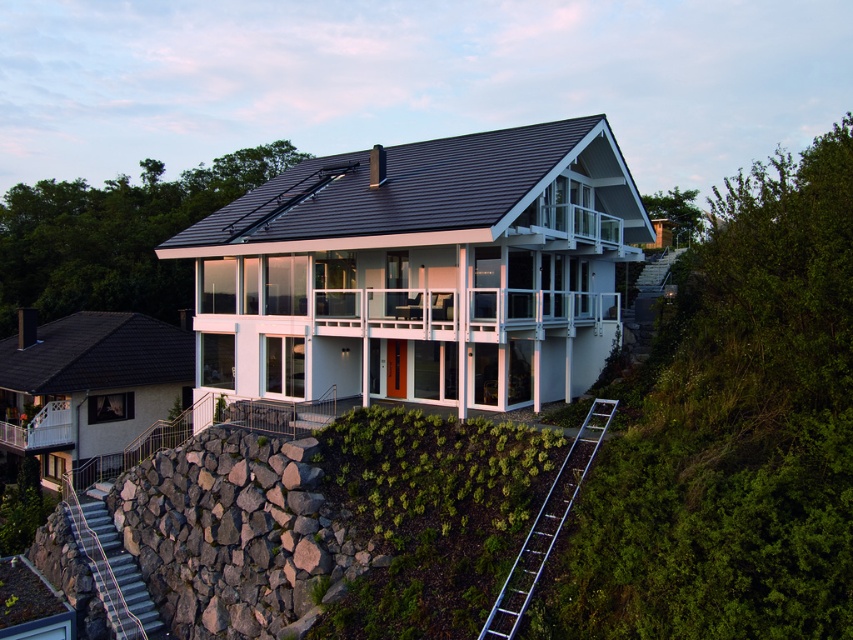
Where is `white glass railing at center`? This screenshot has height=640, width=853. white glass railing at center is located at coordinates (462, 314).

Is point (585, 461) less distant than point (91, 561)?

That is True.

The height and width of the screenshot is (640, 853). What do you see at coordinates (547, 524) in the screenshot? I see `silver metallic ladder at lower right` at bounding box center [547, 524].

Locate an element on the screen. This screenshot has height=640, width=853. silver metallic ladder at lower right is located at coordinates (547, 524).

This screenshot has width=853, height=640. In order to click on silver metallic ladder at lower right in this screenshot , I will do `click(547, 524)`.

Who is more distant from viewer, (292, 328) or (68, 493)?

Point (68, 493)

Between white glass railing at center and rustic stone stairs at lower left, which one appears on the right side from the viewer's perspective?

white glass railing at center

Between point (374, 300) and point (109, 618), which one is positioned in front?

Point (109, 618)

In order to click on white glass railing at center in this screenshot , I will do `click(462, 314)`.